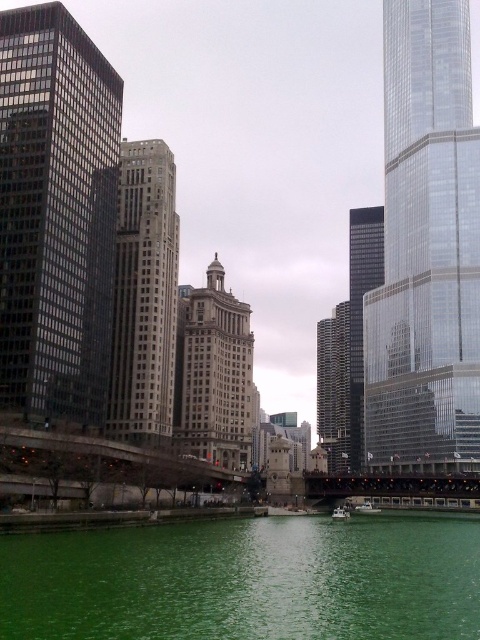
You are a GUI agent. You are given a task and a screenshot of the screen. Output one action in this format:
    pyautogui.click(x=<x>, y=<y>)
    Task: Click on the green liquid at lower center
    This screenshot has height=640, width=480.
    Given the screenshot: What is the action you would take?
    pyautogui.click(x=247, y=580)

Which is above, green liquid at lower center or transparent glass skyscraper at right?

Positioned higher is transparent glass skyscraper at right.

Describe the element at coordinates (247, 580) in the screenshot. I see `green liquid at lower center` at that location.

This screenshot has width=480, height=640. What are the coordinates of `green liquid at lower center` in the screenshot? It's located at (247, 580).

Is the position of matte gray building at center more distant than that of green glass boat at center?

Yes.

This screenshot has width=480, height=640. I want to click on matte gray building at center, so click(x=214, y=374).

From the picture: Who is positioned more to the right, green liquid at lower center or dark gray glass skyscraper at center?

dark gray glass skyscraper at center

Which is below, green liquid at lower center or dark gray glass skyscraper at center?

green liquid at lower center is lower down.

Identify the location of green liquid at lower center. (247, 580).

I want to click on green liquid at lower center, so click(x=247, y=580).